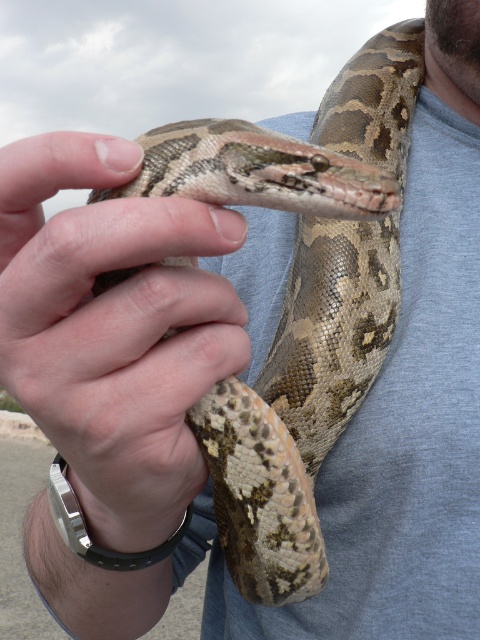
Question: Observing the image, what is the correct spatial positioning of camouflage-patterned snake at center in reference to skinny neck at upper center?

Choices:
 (A) below
 (B) above

Answer: (A)

Question: From the image, what is the correct spatial relationship of leathery tan snake at center in relation to skinny neck at upper center?

Choices:
 (A) right
 (B) left

Answer: (B)

Question: Estimate the real-world distances between objects in this image. Which object is closer to the leathery tan snake at center?

Choices:
 (A) skinny neck at upper center
 (B) camouflage-patterned snake at center

Answer: (B)

Question: Which object is positioned farthest from the leathery tan snake at center?

Choices:
 (A) skinny neck at upper center
 (B) camouflage-patterned snake at center

Answer: (A)

Question: Which object is farther from the camera taking this photo?

Choices:
 (A) camouflage-patterned snake at center
 (B) skinny neck at upper center
 (C) leathery tan snake at center

Answer: (B)

Question: Is camouflage-patterned snake at center positioned in front of skinny neck at upper center?

Choices:
 (A) yes
 (B) no

Answer: (A)